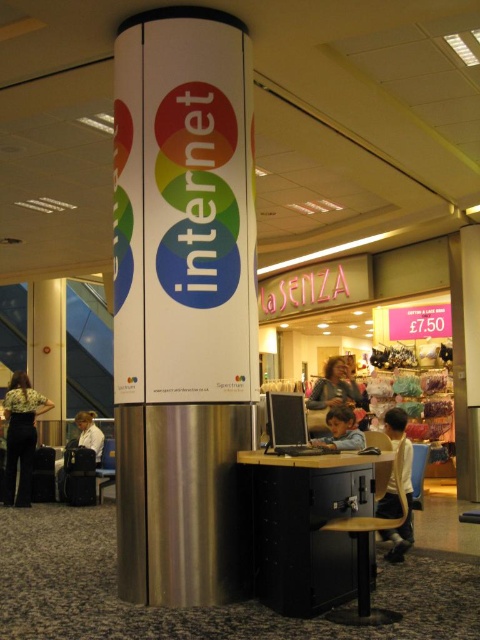
Question: Which object is the closest to the floral blouse at lower left?

Choices:
 (A) black metal cabinet at lower center
 (B) white glossy internet sign at center
 (C) black glossy monitor at center

Answer: (B)

Question: Which point is farther to the camera?

Choices:
 (A) curly hair person at center
 (B) black metal cabinet at lower center
 (C) light brown wooden desk at center
 (D) floral blouse at lower left

Answer: (D)

Question: Is white glossy internet sign at center positioned in front of black glossy monitor at center?

Choices:
 (A) yes
 (B) no

Answer: (B)

Question: Which point is farther from the camera taking this photo?

Choices:
 (A) (354, 406)
 (B) (403, 417)
 (C) (302, 554)

Answer: (A)

Question: Does black metal cabinet at lower center have a larger size compared to curly hair person at center?

Choices:
 (A) yes
 (B) no

Answer: (A)

Question: Can you confirm if black glossy monitor at center is thinner than light brown wooden desk at center?

Choices:
 (A) no
 (B) yes

Answer: (B)